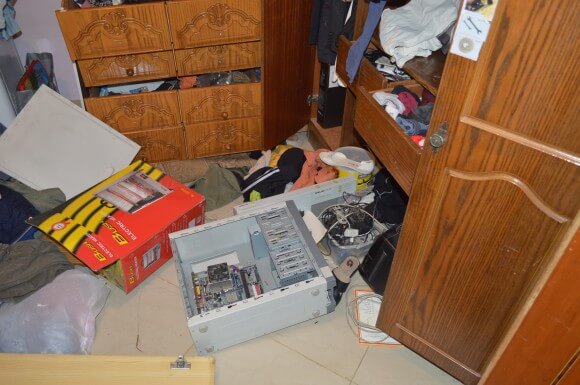
I want to click on metal door nob, so click(433, 139).